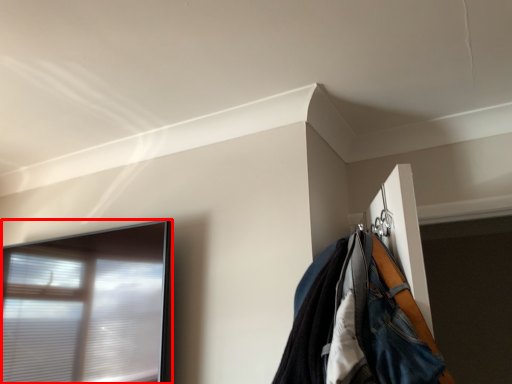
Question: From the image's perspective, what is the correct spatial relationship of window (annotated by the red box) in relation to jacket?

Choices:
 (A) above
 (B) below

Answer: (B)